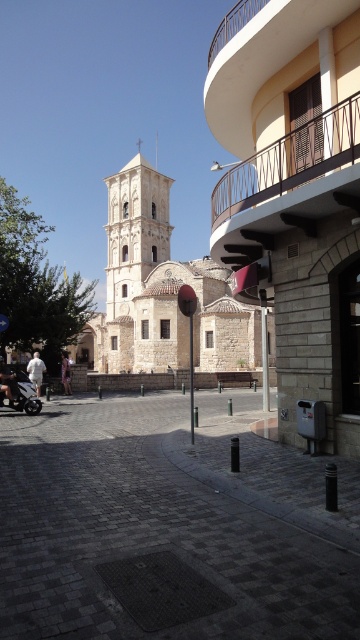
Which is behind, point (0, 400) or point (12, 401)?

The point (0, 400) is behind.

Is point (20, 400) more distant than point (2, 360)?

That is False.

Image resolution: width=360 pixels, height=640 pixels. In order to click on shiny chrome motorcycle at lower left in this screenshot , I will do `click(18, 392)`.

Between light beige stone church at center and shiny chrome motorcycle at lower left, which one has more height?

With more height is light beige stone church at center.

Can you confirm if light beige stone church at center is bigger than shiny chrome motorcycle at lower left?

Yes.

Between point (187, 340) and point (14, 380), which one is positioned in front?

Point (14, 380) is more forward.

The height and width of the screenshot is (640, 360). I want to click on light beige stone church at center, so click(x=160, y=291).

Can you confirm if light beige stone bell tower at center is positioned above white cotton shirt at left?

Yes.

Is point (133, 200) positioned behind point (37, 396)?

Yes, it is.

The width and height of the screenshot is (360, 640). I want to click on light beige stone bell tower at center, so click(132, 260).